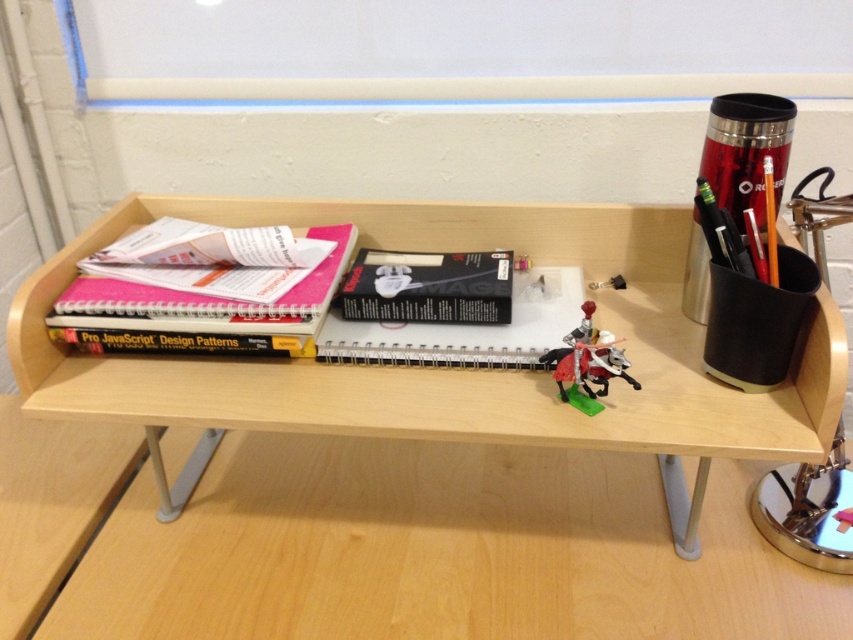
Question: Does spiral-bound paper at center have a greater width compared to black matte notebook at center?

Choices:
 (A) yes
 (B) no

Answer: (A)

Question: Which point is farther from the camera taking this photo?

Choices:
 (A) (91, 301)
 (B) (405, 320)
 (C) (556, 339)

Answer: (B)

Question: Which point is closer to the camera?

Choices:
 (A) wooden table at center
 (B) spiral-bound paper at center
 (C) black matte notebook at center
 (D) metallic silver toy at center

Answer: (A)

Question: Can you confirm if pink matte notebook at upper left is smaller than black matte notebook at center?

Choices:
 (A) yes
 (B) no

Answer: (B)

Question: Which of these objects is positioned farthest from the wooden table at center?

Choices:
 (A) pink matte notebook at upper left
 (B) spiral-bound paper at center
 (C) black matte notebook at center

Answer: (C)

Question: Does pink matte notebook at upper left have a lesser width compared to metallic silver toy at center?

Choices:
 (A) no
 (B) yes

Answer: (A)